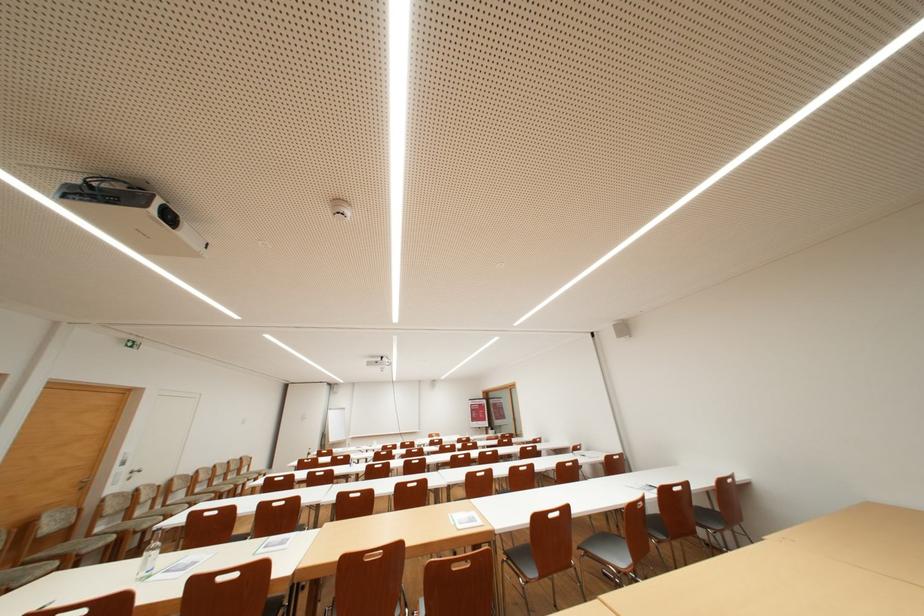
You are a GUI agent. You are given a task and a screenshot of the screen. Output one action in this format:
    pyautogui.click(x=<x>, y=<y>)
    Task: Click on the glass water bottle
    This screenshot has height=616, width=924.
    Given the screenshot: What is the action you would take?
    pyautogui.click(x=150, y=557)